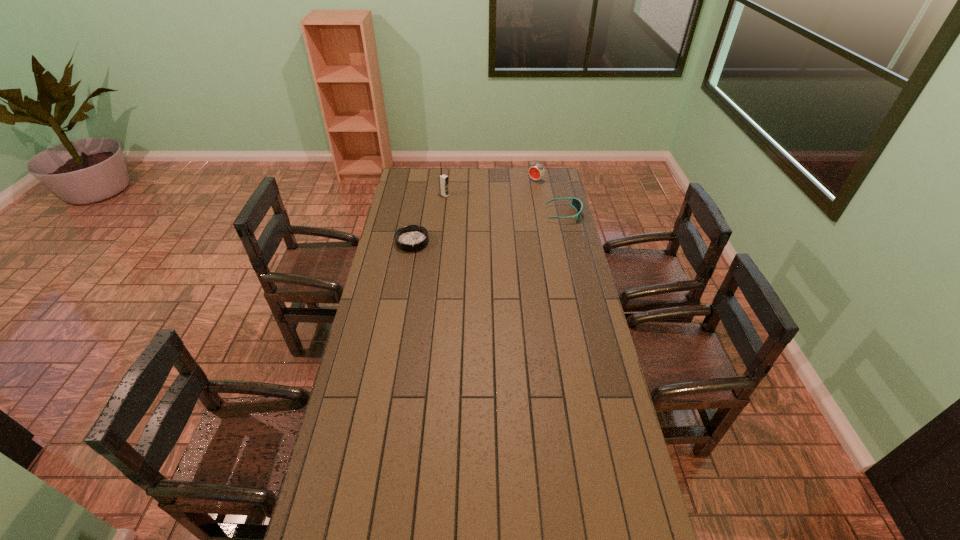
You are a GUI agent. You are given a task and a screenshot of the screen. Output one action in this format:
    pyautogui.click(x=<x>, y=<y>)
    Task: Click on the vacant region at the far edge
    
    Given the screenshot: What is the action you would take?
    pyautogui.click(x=492, y=189)

Image resolution: width=960 pixels, height=540 pixels. What are the coordinates of `vacant area at the near edge of the desktop` in the screenshot? It's located at (520, 509).

You are a GUI agent. You are given a task and a screenshot of the screen. Output one action in this format:
    pyautogui.click(x=<x>, y=<y>)
    Task: Click on the free location at the left edge of the desktop
    
    Given the screenshot: What is the action you would take?
    pyautogui.click(x=417, y=202)

In the image, there is a desktop. Where is `vacant region at the right edge`? vacant region at the right edge is located at coordinates (614, 473).

In the image, there is a desktop. At what (x,y) coordinates should I click in order to perform the action: click on free space at the far left corner. Please return your answer as a coordinate pair (x, y). The width and height of the screenshot is (960, 540). Looking at the image, I should click on pos(409,173).

Locate an element on the screen. The width and height of the screenshot is (960, 540). vacant space at the far right corner of the desktop is located at coordinates (554, 183).

Identify the location of unoccupied area between the second shortest object and the tallest object. (504, 205).

The image size is (960, 540). What are the coordinates of `free point between the ashtray and the alarm clock` in the screenshot? It's located at (x=474, y=211).

What are the coordinates of `empty space that is in between the farthest object and the nearest object` in the screenshot? It's located at point(474,211).

Find the location of a particular element. This screenshot has height=540, width=960. free space between the alarm clock and the tallest object is located at coordinates (491, 188).